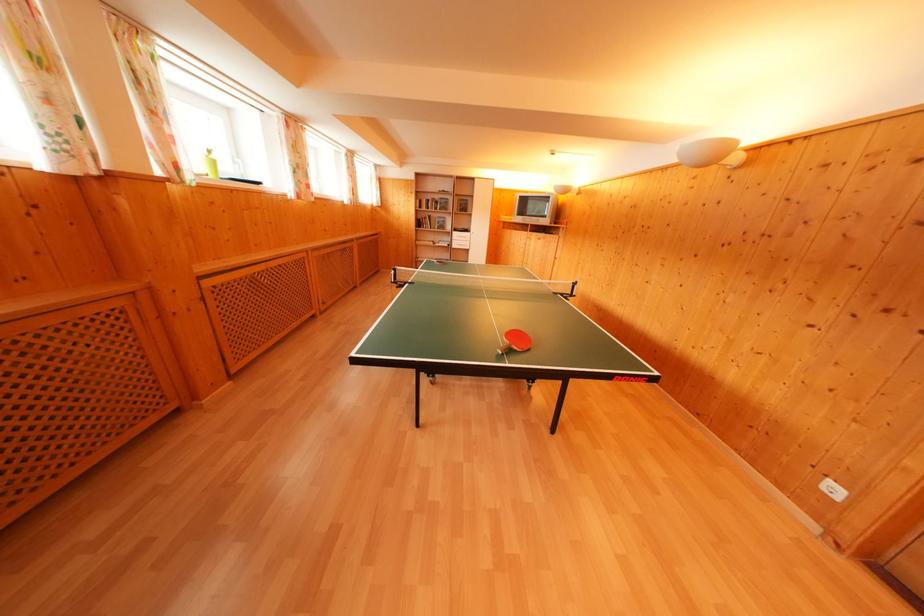
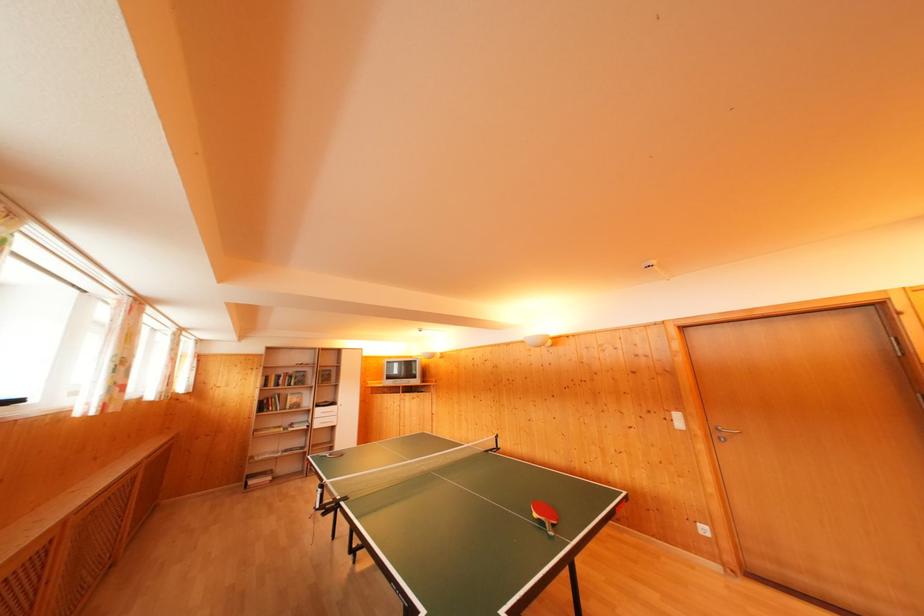
Locate, in the second image, the point that corresponds to pixel 434 203 in the first image.

(286, 377)